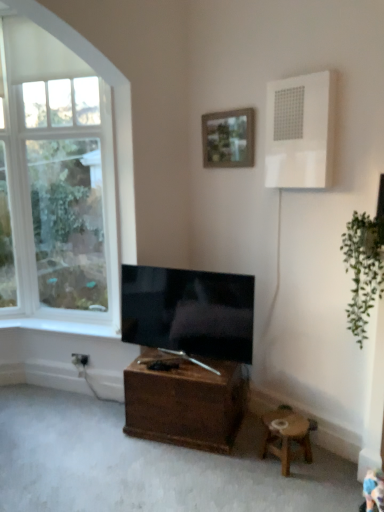
Image resolution: width=384 pixels, height=512 pixels. What do you see at coordinates (286, 437) in the screenshot? I see `wooden stool at lower right` at bounding box center [286, 437].

The width and height of the screenshot is (384, 512). Describe the element at coordinates (363, 269) in the screenshot. I see `green leafy plant at right` at that location.

The image size is (384, 512). What do you see at coordinates (300, 131) in the screenshot?
I see `white plastic air conditioner at upper right` at bounding box center [300, 131].

Measure the distance between point (128, 432) and camera.

The depth of point (128, 432) is 2.73 meters.

Image resolution: width=384 pixels, height=512 pixels. What do you see at coordinates (185, 402) in the screenshot? I see `brown wooden table at center` at bounding box center [185, 402].

Locate an element on the screen. The image size is (384, 512). white smooth window sill at lower left is located at coordinates (63, 326).

Looking at this image, considering the relative sizes of white smooth window sill at lower left and matte black tv at center in the image provided, is white smooth window sill at lower left thinner than matte black tv at center?

Correct, the width of white smooth window sill at lower left is less than that of matte black tv at center.

Based on their positions, is white smooth window sill at lower left located to the left or right of matte black tv at center?

Clearly, white smooth window sill at lower left is on the left of matte black tv at center in the image.

From a real-world perspective, does white smooth window sill at lower left sit lower than matte black tv at center?

Yes, from a real-world perspective, white smooth window sill at lower left is under matte black tv at center.

Is there a large distance between white smooth window sill at lower left and matte black tv at center?

white smooth window sill at lower left is actually quite close to matte black tv at center.

From the image's perspective, which is below, wooden framed picture at upper center or wooden stool at lower right?

wooden stool at lower right appears lower in the image.

Between point (250, 157) and point (307, 435), which one is positioned in front?

Positioned in front is point (307, 435).

Where is `stool lying in front of the wooden framed picture at upper center`? This screenshot has height=512, width=384. stool lying in front of the wooden framed picture at upper center is located at coordinates (286, 437).

Which object is positioned more to the right, wooden framed picture at upper center or wooden stool at lower right?

wooden stool at lower right.

Is brown wooden table at center surrounding white plastic air conditioner at upper right?

No, white plastic air conditioner at upper right is not surrounded by brown wooden table at center.

Considering their positions, is brown wooden table at center located in front of or behind white plastic air conditioner at upper right?

brown wooden table at center is positioned farther from the viewer than white plastic air conditioner at upper right.

Does white glass window at upper left have a lesser height compared to brown wooden table at center?

Incorrect, the height of white glass window at upper left does not fall short of that of brown wooden table at center.

Does white glass window at upper left turn towards brown wooden table at center?

No, white glass window at upper left is not oriented towards brown wooden table at center.

Does point (20, 305) appear closer or farther from the camera than point (238, 407)?

Point (20, 305) appears to be farther away from the viewer than point (238, 407).

Would you say green leafy plant at right is outside white plastic air conditioner at upper right?

Absolutely, green leafy plant at right is external to white plastic air conditioner at upper right.

At what (x,y) coordinates should I click in order to perform the action: click on houseplant on the right of white plastic air conditioner at upper right. Please return your answer as a coordinate pair (x, y). This screenshot has height=512, width=384. Looking at the image, I should click on (363, 269).

From a real-world perspective, is green leafy plant at right positioned over white plastic air conditioner at upper right based on gravity?

No.

Locate an element on the screen. The height and width of the screenshot is (512, 384). houseplant in front of the matte black tv at center is located at coordinates (363, 269).

Is green leafy plant at right inside matte black tv at center?

That's incorrect, green leafy plant at right is not inside matte black tv at center.

Does matte black tv at center have a greater height compared to green leafy plant at right?

No.

Considering the points (181, 308) and (361, 302), which point is in front, point (181, 308) or point (361, 302)?

The point (361, 302) is more forward.

Are white plastic air conditioner at upper right and white smooth window sill at lower left making contact?

No.

From their relative heights in the image, would you say white plastic air conditioner at upper right is taller or shorter than white smooth window sill at lower left?

Clearly, white plastic air conditioner at upper right is taller compared to white smooth window sill at lower left.

Is white plastic air conditioner at upper right to the left or to the right of white smooth window sill at lower left in the image?

In the image, white plastic air conditioner at upper right appears on the right side of white smooth window sill at lower left.

The width and height of the screenshot is (384, 512). Find the location of `television in front of the white smooth window sill at lower left`. television in front of the white smooth window sill at lower left is located at coordinates (189, 311).

Identify the location of picture frame behind the wooden stool at lower right. (228, 138).

Based on the photo, looking at the image, which one is located closer to brown wooden table at center, green leafy plant at right or white smooth window sill at lower left?

white smooth window sill at lower left lies closer to brown wooden table at center than the other object.

Based on their spatial positions, is wooden stool at lower right or white smooth window sill at lower left closer to wooden framed picture at upper center?

Based on the image, white smooth window sill at lower left appears to be nearer to wooden framed picture at upper center.

Considering their positions, is brown wooden table at center positioned closer to white smooth window sill at lower left than wooden stool at lower right?

brown wooden table at center.

Looking at the image, which one is located further to wooden framed picture at upper center, matte black tv at center or white glass window at upper left?

white glass window at upper left.

Estimate the real-world distances between objects in this image. Which object is further from green leafy plant at right, wooden stool at lower right or brown wooden table at center?

Among the two, brown wooden table at center is located further to green leafy plant at right.

When comparing their distances from green leafy plant at right, does wooden framed picture at upper center or brown wooden table at center seem closer?

wooden framed picture at upper center lies closer to green leafy plant at right than the other object.

Based on their spatial positions, is wooden framed picture at upper center or white smooth window sill at lower left closer to green leafy plant at right?

wooden framed picture at upper center.

Based on their spatial positions, is white plastic air conditioner at upper right or brown wooden table at center further from white glass window at upper left?

The object further to white glass window at upper left is white plastic air conditioner at upper right.

The height and width of the screenshot is (512, 384). In order to click on window sill between white glass window at upper left and white plastic air conditioner at upper right from left to right in this screenshot , I will do (x=63, y=326).

You are a GUI agent. You are given a task and a screenshot of the screen. Output one action in this format:
    pyautogui.click(x=<x>, y=<y>)
    Task: Click on the table situated between white smooth window sill at lower left and green leafy plant at right from left to right
    The height and width of the screenshot is (512, 384).
    Given the screenshot: What is the action you would take?
    pyautogui.click(x=185, y=402)

Locate an element on the screen. This screenshot has width=384, height=512. television that lies between white glass window at upper left and wooden stool at lower right from top to bottom is located at coordinates (189, 311).

This screenshot has width=384, height=512. I want to click on television between white smooth window sill at lower left and brown wooden table at center from left to right, so click(x=189, y=311).